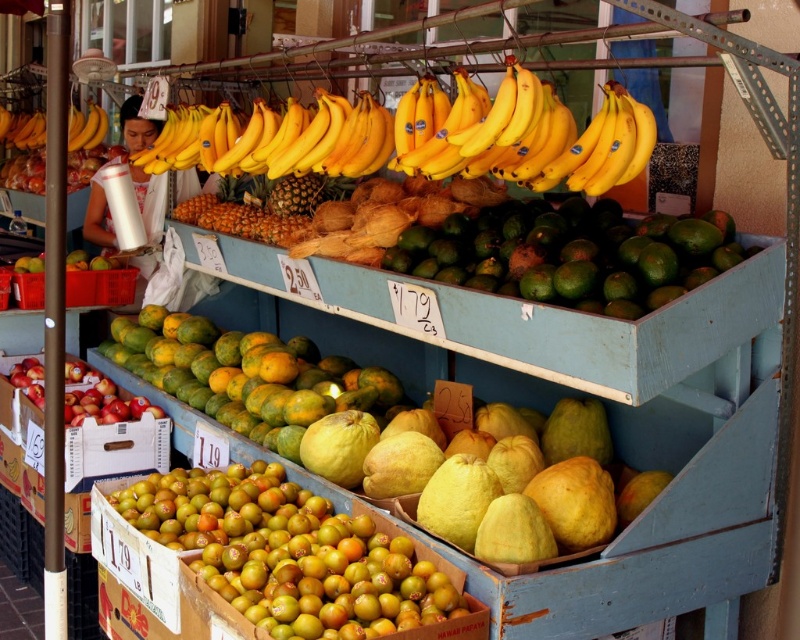
Which is above, yellow matte quince at center or green matte papaya at center?

green matte papaya at center

Where is `yellow matte quince at center`? yellow matte quince at center is located at coordinates (408, 442).

Does point (346, 376) come in front of point (180, 355)?

Yes, point (346, 376) is closer to viewer.

The height and width of the screenshot is (640, 800). Identify the location of yellow matte quince at center. (408, 442).

Does green matte plum at lower left come behind green matte mangoes at center?

No, green matte plum at lower left is closer to the viewer.

Does green matte plum at lower left have a greater height compared to green matte mangoes at center?

No, green matte plum at lower left is not taller than green matte mangoes at center.

The width and height of the screenshot is (800, 640). Find the location of `green matte plum at lower left`. green matte plum at lower left is located at coordinates (292, 556).

Identify the location of green matte plum at lower left. (292, 556).

Can you confirm if green matte mangoes at center is taller than green matte papaya at center?

Incorrect, green matte mangoes at center's height is not larger of green matte papaya at center's.

Is green matte mangoes at center closer to the viewer compared to green matte papaya at center?

Yes, it is in front of green matte papaya at center.

Describe the element at coordinates (572, 253) in the screenshot. I see `green matte mangoes at center` at that location.

This screenshot has height=640, width=800. Find the location of `green matte mangoes at center`. green matte mangoes at center is located at coordinates (572, 253).